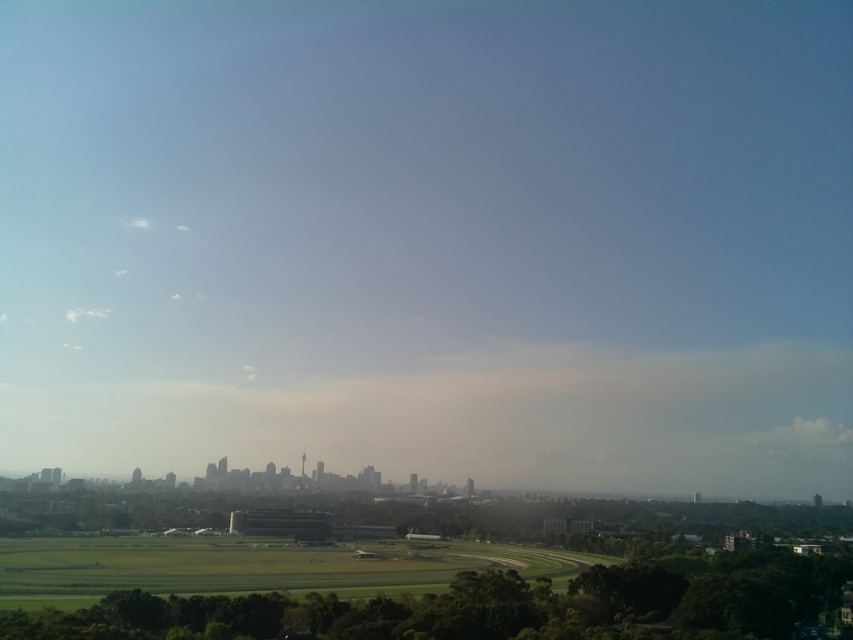
Does green grass at center have a lesser width compared to white fluffy cloud at upper left?

In fact, green grass at center might be wider than white fluffy cloud at upper left.

Which is behind, point (221, 545) or point (100, 310)?

Positioned behind is point (100, 310).

Between point (518, 547) and point (99, 308), which one is positioned behind?

The point (99, 308) is behind.

Find the location of a particular element. The height and width of the screenshot is (640, 853). green grass at center is located at coordinates (253, 564).